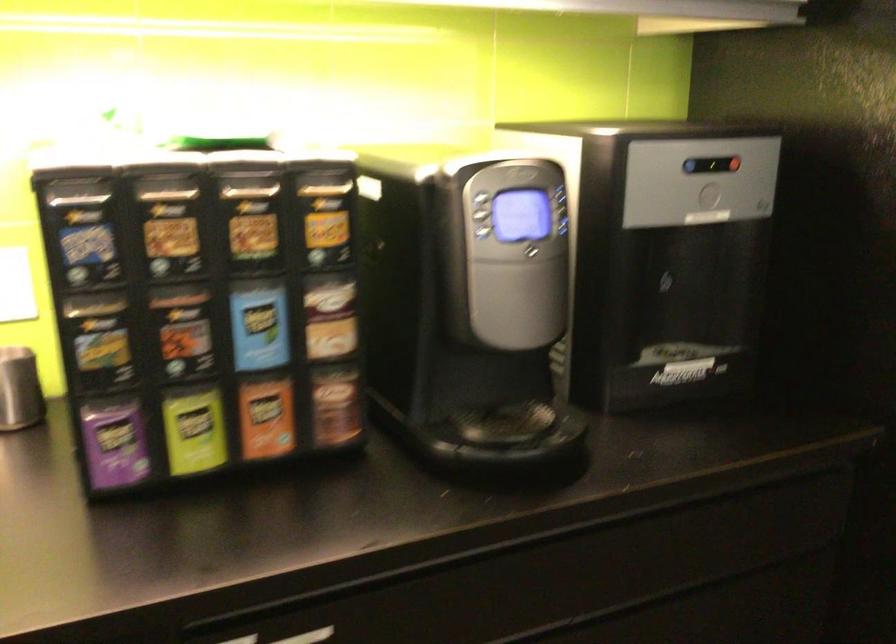
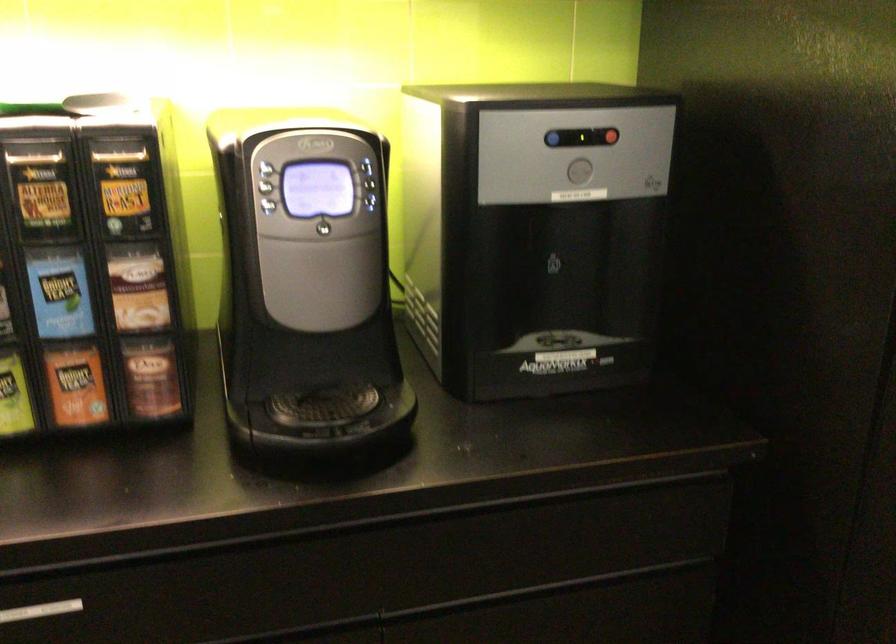
In the second image, find the point that corresponds to (x=709, y=194) in the first image.

(579, 172)